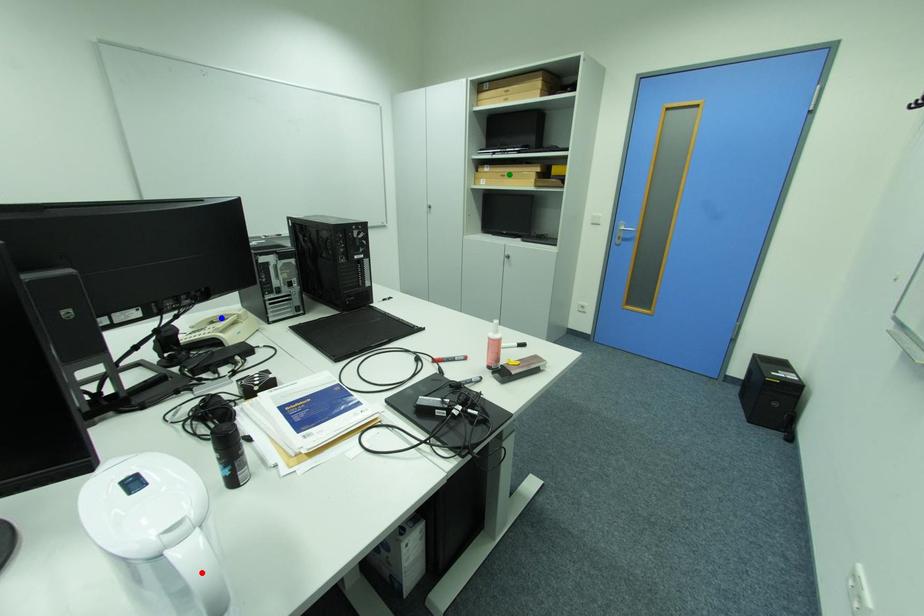
Order these from nearest to farthest:
A) blue point
B) red point
C) green point

1. green point
2. blue point
3. red point